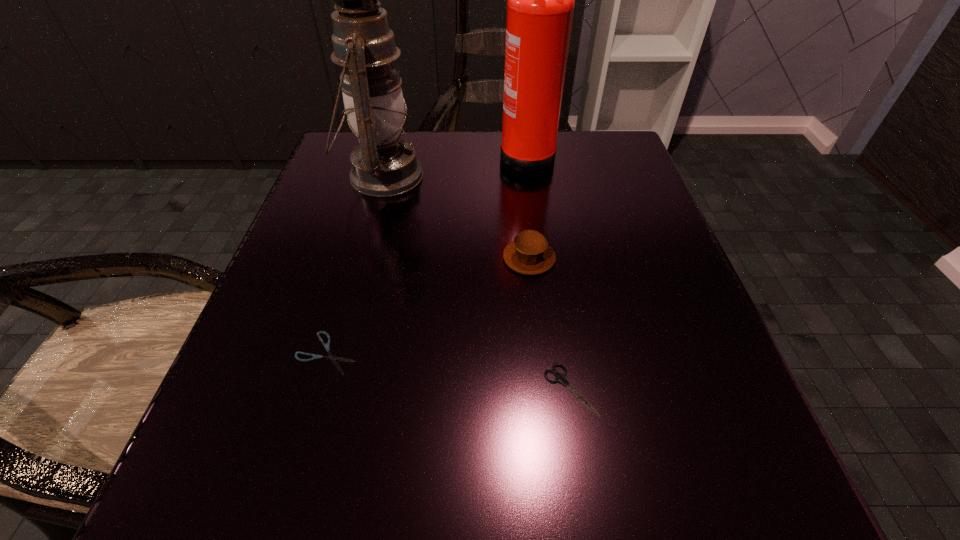
This screenshot has height=540, width=960. I want to click on vacant region located 0.270m at the nozzle of the fire extinguisher, so click(374, 156).

Where is `vacant region located on the right of the oil lamp`? vacant region located on the right of the oil lamp is located at coordinates (565, 176).

This screenshot has height=540, width=960. Find the location of `vacant region located 0.190m on the right of the third shortest object`. vacant region located 0.190m on the right of the third shortest object is located at coordinates (670, 258).

Find the location of a particular element. This screenshot has height=540, width=960. vacant space situated on the right of the fourth tallest object is located at coordinates (635, 389).

Find the location of a particular element. vacant space situated on the back of the shorter shears is located at coordinates (359, 242).

Locate an element on the screen. fire extinguisher present at the far edge is located at coordinates (540, 0).

Where is `oil lamp present at the far edge`? The width and height of the screenshot is (960, 540). oil lamp present at the far edge is located at coordinates (383, 165).

Identify the location of oil lamp present at the left edge. (383, 165).

Where is `shears located at the left edge`? shears located at the left edge is located at coordinates (327, 346).

At what (x,y) coordinates should I click in order to perform the action: click on object situated at the far left corner. Please return your answer as a coordinate pair (x, y). The height and width of the screenshot is (540, 960). Looking at the image, I should click on (383, 165).